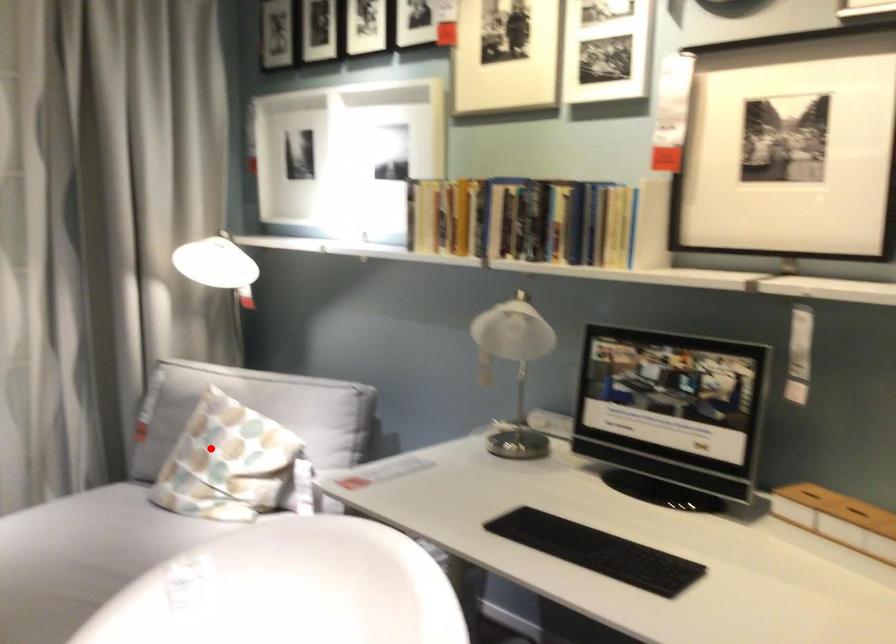
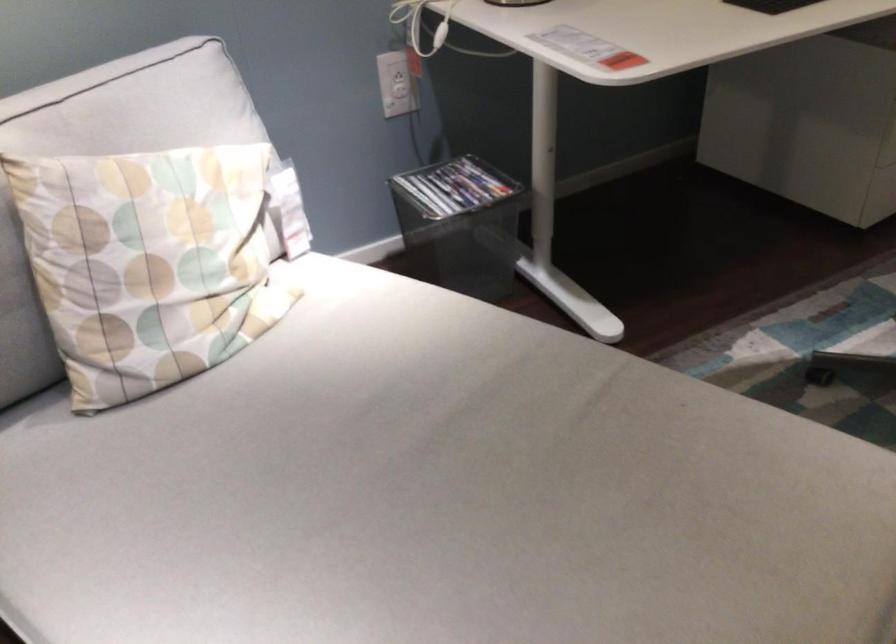
Question: I am providing you with two images of the same scene from different viewpoints. Given a red point in image1, look at the same physical point in image2. Is it:

Choices:
 (A) Closer to the viewpoint
 (B) Farther from the viewpoint

Answer: (A)